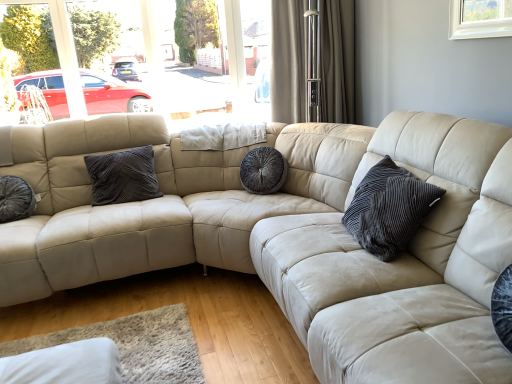
Question: Does dark grey velvet pillow at center, arranged as the second pillow when viewed from the right, come behind velvet dark gray pillow at center, which is the third pillow in left-to-right order?

Choices:
 (A) yes
 (B) no

Answer: (A)

Question: Considering the relative sizes of dark grey velvet pillow at center, which appears as the 3th pillow when viewed from the front, and velvet dark gray pillow at center, which ranks as the 1th pillow in right-to-left order, in the image provided, is dark grey velvet pillow at center, which appears as the 3th pillow when viewed from the front, wider than velvet dark gray pillow at center, which ranks as the 1th pillow in right-to-left order,?

Choices:
 (A) yes
 (B) no

Answer: (A)

Question: Could you tell me if dark grey velvet pillow at center, arranged as the second pillow when viewed from the right, is turned towards velvet dark gray pillow at center, the first pillow positioned from the front?

Choices:
 (A) yes
 (B) no

Answer: (B)

Question: Is dark grey velvet pillow at center, marked as the 1th pillow in a back-to-front arrangement, shorter than velvet dark gray pillow at center, which ranks as the 1th pillow in right-to-left order?

Choices:
 (A) no
 (B) yes

Answer: (B)

Question: Is velvet dark gray pillow at center, which ranks as the 1th pillow in right-to-left order, a part of dark grey velvet pillow at center, which appears as the 3th pillow when viewed from the front?

Choices:
 (A) no
 (B) yes

Answer: (A)

Question: Is dark grey velvet pillow at center, which appears as the 3th pillow when viewed from the front, oriented away from velvet dark gray pillow at center, which ranks as the 1th pillow in right-to-left order?

Choices:
 (A) yes
 (B) no

Answer: (B)

Question: Is beige textured curtain at upper center next to velvet dark gray pillow at left, placed as the 2th pillow when sorted from back to front?

Choices:
 (A) no
 (B) yes

Answer: (A)

Question: Considering the relative sizes of beige textured curtain at upper center and velvet dark gray pillow at left, the 1th pillow viewed from the left, in the image provided, is beige textured curtain at upper center bigger than velvet dark gray pillow at left, the 1th pillow viewed from the left,?

Choices:
 (A) yes
 (B) no

Answer: (A)

Question: From a real-world perspective, is beige textured curtain at upper center on top of velvet dark gray pillow at left, the 1th pillow viewed from the left?

Choices:
 (A) yes
 (B) no

Answer: (A)

Question: From a real-world perspective, is beige textured curtain at upper center under velvet dark gray pillow at left, the 1th pillow viewed from the left?

Choices:
 (A) no
 (B) yes

Answer: (A)

Question: Is beige textured curtain at upper center far from velvet dark gray pillow at left, which ranks as the 2th pillow in front-to-back order?

Choices:
 (A) no
 (B) yes

Answer: (B)

Question: Is beige textured curtain at upper center to the right of velvet dark gray pillow at left, the 1th pillow viewed from the left, from the viewer's perspective?

Choices:
 (A) no
 (B) yes

Answer: (B)

Question: From the image's perspective, does dark grey velvet pillow at center, arranged as the second pillow when viewed from the right, appear lower than velvet dark gray pillow at left, the 1th pillow viewed from the left?

Choices:
 (A) yes
 (B) no

Answer: (B)